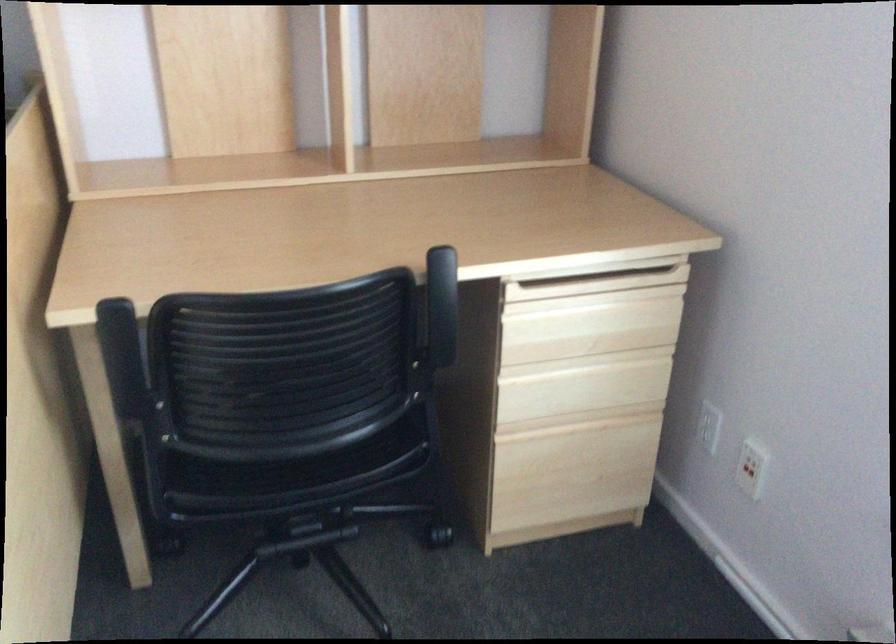
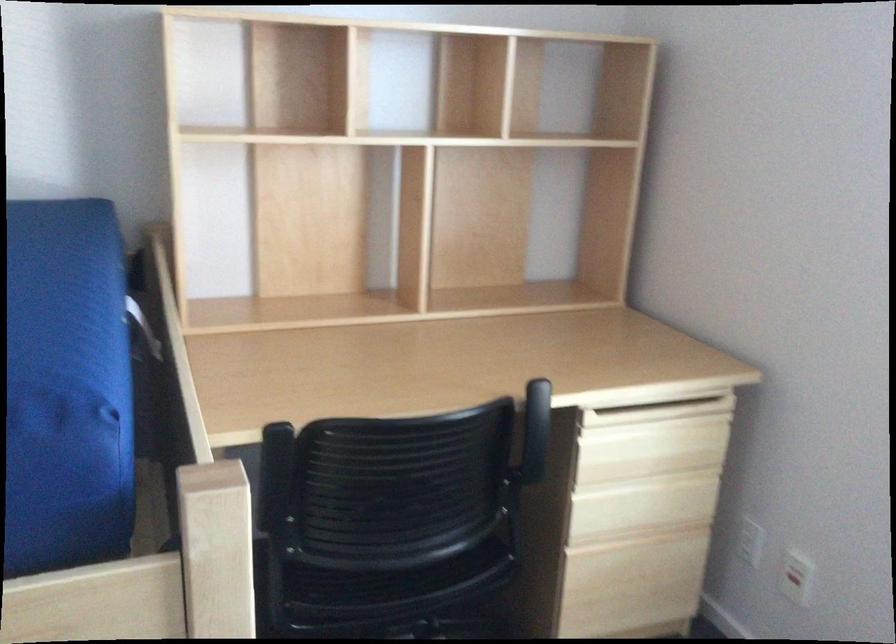
Where in the second image is the point corresponding to pixel 581 388 from the first image?

(642, 506)